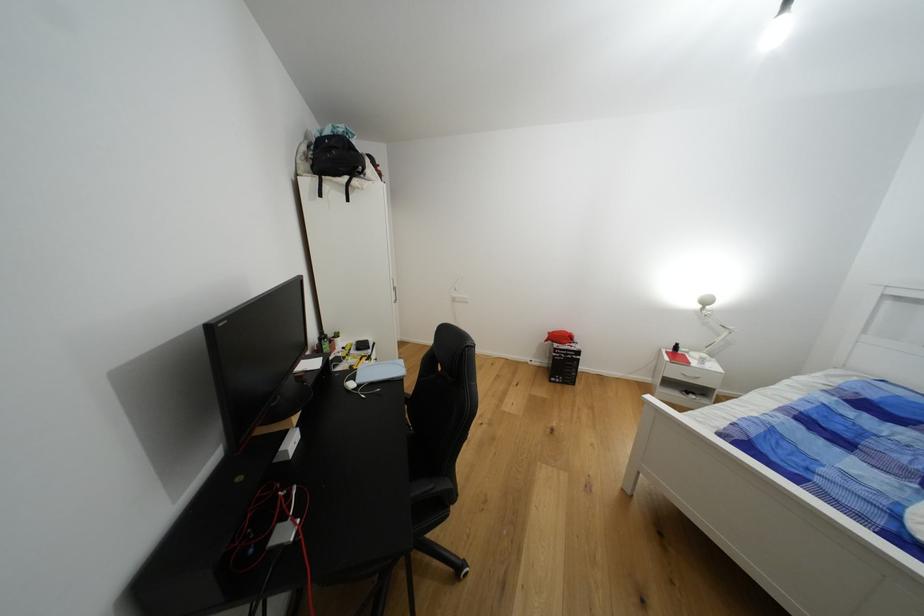
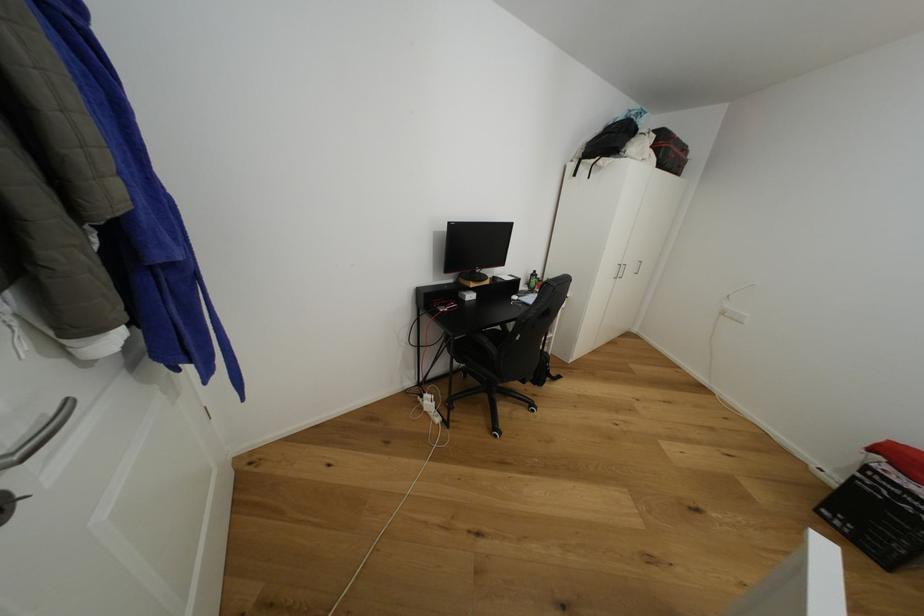
Locate, in the second image, the point that corresponds to pixel 562 346 in the first image.

(893, 469)